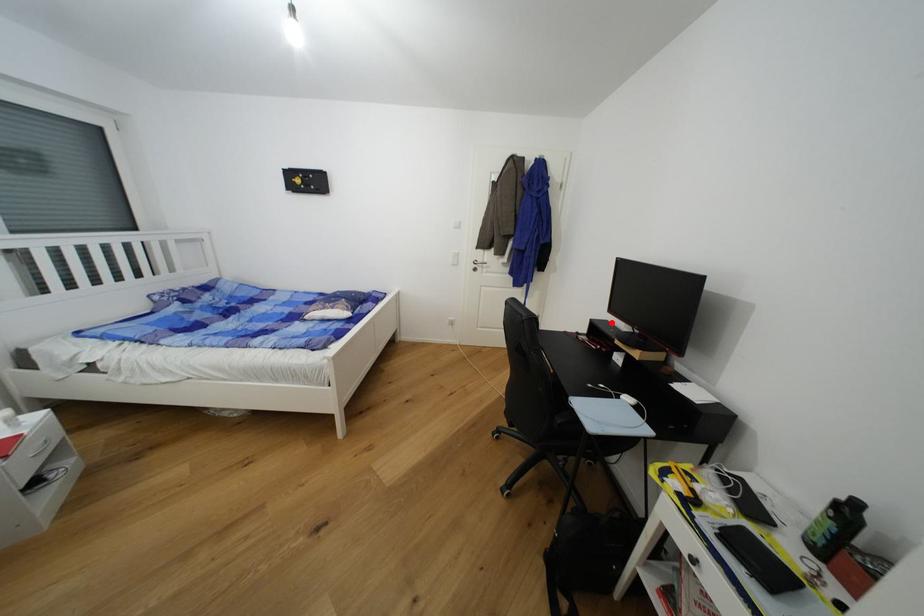
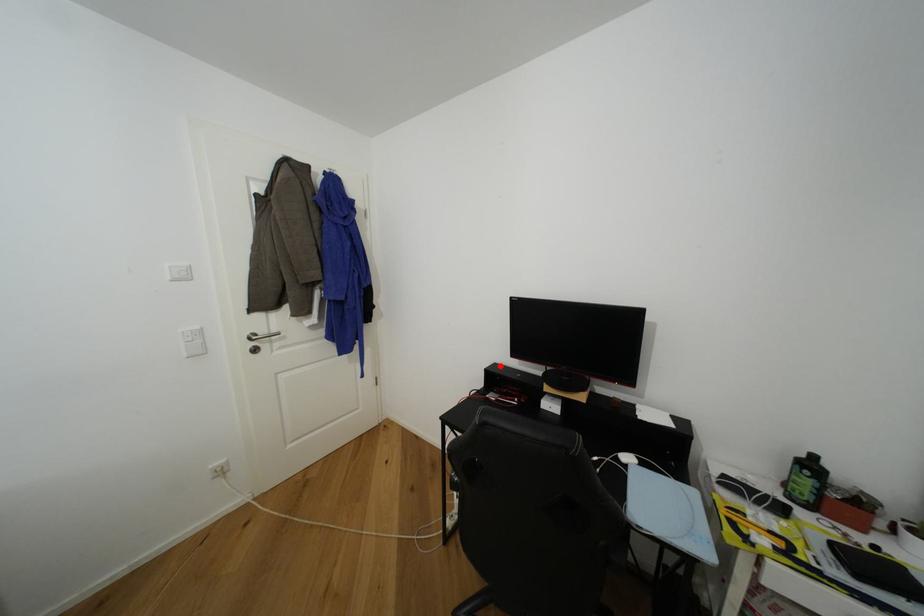
I am providing you with two images of the same scene from different viewpoints. A red point is marked on the first image and another point is marked on the second image. Does the point marked in image1 correspond to the same location as the one in image2?

Yes